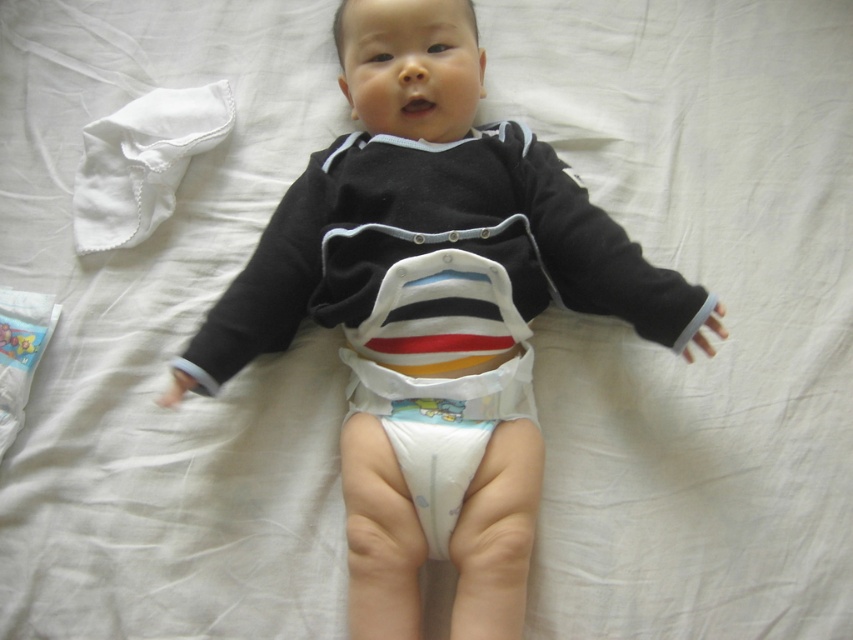
Does point (483, 493) lie in front of point (445, 396)?

Yes, point (483, 493) is closer to viewer.

Is soft cotton baby at center to the right of white paper diaper at center from the viewer's perspective?

Indeed, soft cotton baby at center is positioned on the right side of white paper diaper at center.

Is point (556, 189) positioned after point (442, 396)?

Yes, point (556, 189) is behind point (442, 396).

At what (x,y) coordinates should I click in order to perform the action: click on soft cotton baby at center. Please return your answer as a coordinate pair (x, y). The height and width of the screenshot is (640, 853). Looking at the image, I should click on (431, 225).